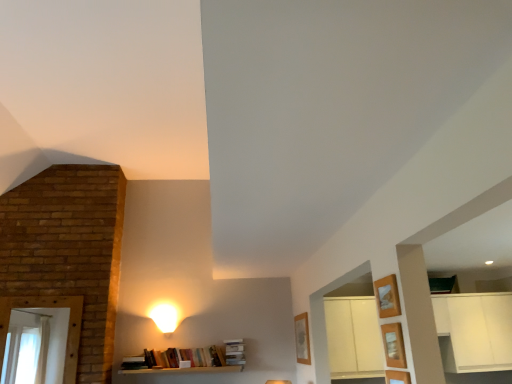
Question: Can you confirm if wooden shelf at lower right, the first shelf positioned from the bottom, is smaller than wooden shelf at lower right, which is the 2th shelf in bottom-to-top order?

Choices:
 (A) no
 (B) yes

Answer: (A)

Question: Does wooden shelf at lower right, placed as the 3th shelf when sorted from top to bottom, have a lesser height compared to wooden shelf at lower right, which is counted as the second shelf, starting from the top?

Choices:
 (A) no
 (B) yes

Answer: (B)

Question: From a real-world perspective, is wooden shelf at lower right, placed as the 3th shelf when sorted from top to bottom, on top of wooden shelf at lower right, which is the 2th shelf in bottom-to-top order?

Choices:
 (A) yes
 (B) no

Answer: (B)

Question: Is wooden shelf at lower right, the first shelf positioned from the bottom, facing towards wooden shelf at lower right, which is counted as the second shelf, starting from the top?

Choices:
 (A) yes
 (B) no

Answer: (B)

Question: Can you confirm if wooden shelf at lower right, the first shelf positioned from the bottom, is positioned to the right of wooden shelf at lower right, which is counted as the second shelf, starting from the top?

Choices:
 (A) yes
 (B) no

Answer: (A)

Question: Based on their sizes in the image, would you say wooden frame at upper right, which ranks as the first shelf in top-to-bottom order, is bigger or smaller than wooden shelf at lower right, the first shelf positioned from the bottom?

Choices:
 (A) big
 (B) small

Answer: (A)

Question: Considering their positions, is wooden frame at upper right, which ranks as the first shelf in top-to-bottom order, located in front of or behind wooden shelf at lower right, the first shelf positioned from the bottom?

Choices:
 (A) behind
 (B) front

Answer: (A)

Question: From a real-world perspective, relative to wooden shelf at lower right, the first shelf positioned from the bottom, is wooden frame at upper right, acting as the 3th shelf starting from the bottom, vertically above or below?

Choices:
 (A) above
 (B) below

Answer: (A)

Question: Looking at their shapes, would you say wooden frame at upper right, acting as the 3th shelf starting from the bottom, is wider or thinner than wooden shelf at lower right, placed as the 3th shelf when sorted from top to bottom?

Choices:
 (A) thin
 (B) wide

Answer: (B)

Question: From a real-world perspective, relative to wooden shelf at lower right, the first shelf positioned from the bottom, is matte white lampshade at upper center vertically above or below?

Choices:
 (A) above
 (B) below

Answer: (A)

Question: Based on their sizes in the image, would you say matte white lampshade at upper center is bigger or smaller than wooden shelf at lower right, the first shelf positioned from the bottom?

Choices:
 (A) small
 (B) big

Answer: (B)

Question: Visually, is matte white lampshade at upper center positioned to the left or to the right of wooden shelf at lower right, the first shelf positioned from the bottom?

Choices:
 (A) left
 (B) right

Answer: (A)

Question: Would you say matte white lampshade at upper center is inside or outside wooden shelf at lower right, the first shelf positioned from the bottom?

Choices:
 (A) outside
 (B) inside

Answer: (A)

Question: Considering their positions, is wooden shelf at lower right, which is counted as the second shelf, starting from the top, located in front of or behind matte white lampshade at upper center?

Choices:
 (A) front
 (B) behind

Answer: (A)

Question: From a real-world perspective, is wooden shelf at lower right, which is the 2th shelf in bottom-to-top order, positioned above or below matte white lampshade at upper center?

Choices:
 (A) below
 (B) above

Answer: (A)